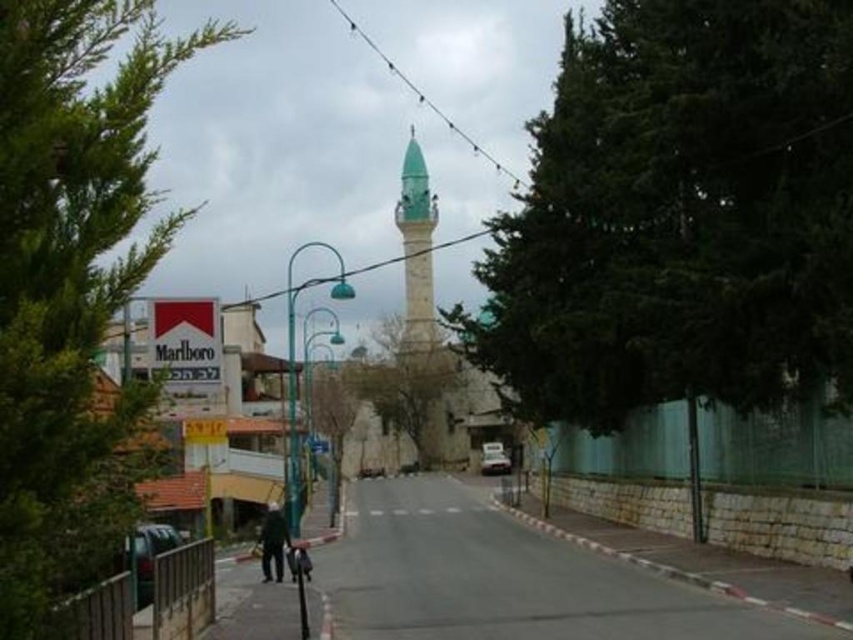
Question: Is green leafy tree at upper center smaller than green leafy tree at left?

Choices:
 (A) no
 (B) yes

Answer: (B)

Question: Which of the following is the farthest from the observer?

Choices:
 (A) green leafy tree at left
 (B) green stone minaret at center

Answer: (B)

Question: Does green leafy tree at upper center appear over green stone minaret at center?

Choices:
 (A) no
 (B) yes

Answer: (A)

Question: Which of the following is the farthest from the observer?

Choices:
 (A) green stone minaret at center
 (B) green leafy tree at upper center
 (C) green leafy tree at left
 (D) dark gray fabric jacket at center

Answer: (A)

Question: Does green leafy tree at left lie behind green stone minaret at center?

Choices:
 (A) no
 (B) yes

Answer: (A)

Question: Which is farther from the green stone minaret at center?

Choices:
 (A) green leafy tree at left
 (B) green leafy tree at upper center

Answer: (B)